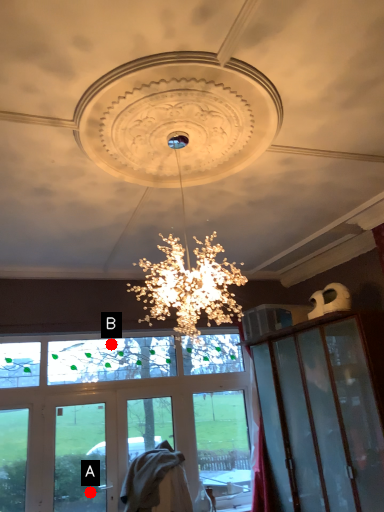
Question: Two points are circled on the image, labeled by A and B beside each circle. Which point is farther to the camera?

Choices:
 (A) A is further
 (B) B is further

Answer: (B)